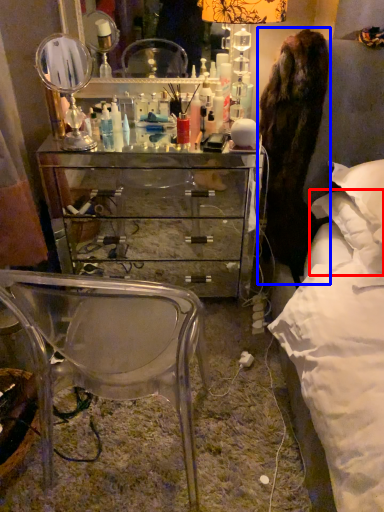
Question: Which of the following is the closest to the observer, pillow (highlighted by a red box) or fur coat (highlighted by a blue box)?

Choices:
 (A) pillow
 (B) fur coat

Answer: (A)